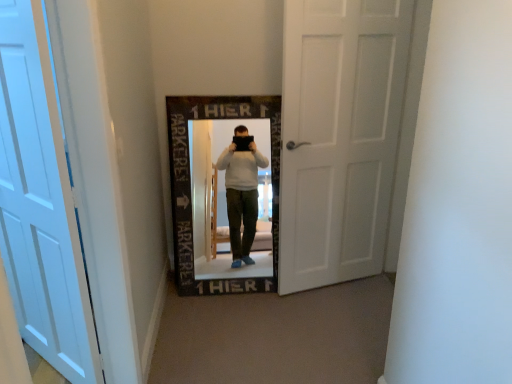
This screenshot has height=384, width=512. Describe the element at coordinates (339, 136) in the screenshot. I see `white matte door at center, which appears as the 1th door when viewed from the back` at that location.

Where is `white matte door at center, the 2th door when ordered from front to back`? white matte door at center, the 2th door when ordered from front to back is located at coordinates (339, 136).

This screenshot has width=512, height=384. Describe the element at coordinates (40, 203) in the screenshot. I see `white matte door at left, marked as the 1th door in a front-to-back arrangement` at that location.

The width and height of the screenshot is (512, 384). What are the coordinates of `white matte door at left, which is counted as the first door, starting from the left` in the screenshot? It's located at point(40,203).

Measure the distance between white matte door at left, which appears as the second door when viewed from the right, and camera.

They are 1.31 meters apart.

In order to click on white matte door at center, which appears as the 1th door when viewed from the back in this screenshot , I will do `click(339, 136)`.

Can you confirm if white matte door at center, positioned as the first door in right-to-left order, is positioned to the right of white matte door at left, which appears as the second door when viewed from the right?

Yes.

Does white matte door at center, positioned as the first door in right-to-left order, come in front of white matte door at left, which appears as the second door when viewed from the right?

No, white matte door at center, positioned as the first door in right-to-left order, is behind white matte door at left, which appears as the second door when viewed from the right.

Which is behind, point (350, 87) or point (46, 120)?

The point (350, 87) is farther.

From the image's perspective, is white matte door at center, the second door viewed from the left, beneath white matte door at left, marked as the 1th door in a front-to-back arrangement?

No.

From a real-world perspective, which is physically below, white matte door at center, positioned as the first door in right-to-left order, or white matte door at left, which appears as the second door when viewed from the right?

From a 3D spatial view, white matte door at left, which appears as the second door when viewed from the right, is below.

Can you confirm if white matte door at center, the 2th door when ordered from front to back, is thinner than white matte door at left, which appears as the second door when viewed from the right?

Indeed, white matte door at center, the 2th door when ordered from front to back, has a lesser width compared to white matte door at left, which appears as the second door when viewed from the right.

Which of these two, white matte door at center, the 2th door when ordered from front to back, or white matte door at left, placed as the 2th door when sorted from back to front, stands shorter?

white matte door at left, placed as the 2th door when sorted from back to front, is shorter.

Does white matte door at center, the second door viewed from the left, have a larger size compared to white matte door at left, which appears as the second door when viewed from the right?

Yes, white matte door at center, the second door viewed from the left, is bigger than white matte door at left, which appears as the second door when viewed from the right.

Is white matte door at center, which appears as the 1th door when viewed from the back, inside the boundaries of white matte door at left, marked as the 1th door in a front-to-back arrangement, or outside?

The correct answer is: outside.

Looking at this image, is white matte door at center, the 2th door when ordered from front to back, next to white matte door at left, which appears as the second door when viewed from the right?

No, white matte door at center, the 2th door when ordered from front to back, is not beside white matte door at left, which appears as the second door when viewed from the right.

Is white matte door at center, the 2th door when ordered from front to back, positioned with its back to white matte door at left, placed as the 2th door when sorted from back to front?

No, white matte door at center, the 2th door when ordered from front to back, is not facing away from white matte door at left, placed as the 2th door when sorted from back to front.

Can you tell me how much white matte door at center, positioned as the first door in right-to-left order, and white matte door at left, which is counted as the first door, starting from the left, differ in facing direction?

The angle between the facing direction of white matte door at center, positioned as the first door in right-to-left order, and the facing direction of white matte door at left, which is counted as the first door, starting from the left, is 63 degrees.

At what (x,y) coordinates should I click in order to perform the action: click on door below the white matte door at center, the second door viewed from the left (from a real-world perspective). Please return your answer as a coordinate pair (x, y). Looking at the image, I should click on (40, 203).

Is white matte door at left, which is counted as the first door, starting from the left, to the right of white matte door at center, the second door viewed from the left, from the viewer's perspective?

In fact, white matte door at left, which is counted as the first door, starting from the left, is to the left of white matte door at center, the second door viewed from the left.

Does white matte door at left, marked as the 1th door in a front-to-back arrangement, lie behind white matte door at center, positioned as the first door in right-to-left order?

No, white matte door at left, marked as the 1th door in a front-to-back arrangement, is in front of white matte door at center, positioned as the first door in right-to-left order.

Considering the positions of point (12, 59) and point (296, 221), is point (12, 59) closer or farther from the camera than point (296, 221)?

Point (12, 59).

From the image's perspective, who appears lower, white matte door at left, placed as the 2th door when sorted from back to front, or white matte door at center, the second door viewed from the left?

white matte door at left, placed as the 2th door when sorted from back to front, is shown below in the image.

Based on the photo, from a real-world perspective, relative to white matte door at center, the 2th door when ordered from front to back, is white matte door at left, placed as the 2th door when sorted from back to front, vertically above or below?

white matte door at left, placed as the 2th door when sorted from back to front, is below white matte door at center, the 2th door when ordered from front to back.

Considering the sizes of objects white matte door at left, which appears as the second door when viewed from the right, and white matte door at center, which appears as the 1th door when viewed from the back, in the image provided, who is thinner, white matte door at left, which appears as the second door when viewed from the right, or white matte door at center, which appears as the 1th door when viewed from the back,?

With smaller width is white matte door at center, which appears as the 1th door when viewed from the back.

Between white matte door at left, marked as the 1th door in a front-to-back arrangement, and white matte door at center, the 2th door when ordered from front to back, which one has less height?

→ With less height is white matte door at left, marked as the 1th door in a front-to-back arrangement.

Based on their sizes in the image, would you say white matte door at left, which is counted as the first door, starting from the left, is bigger or smaller than white matte door at center, the 2th door when ordered from front to back?

In the image, white matte door at left, which is counted as the first door, starting from the left, appears to be smaller than white matte door at center, the 2th door when ordered from front to back.

Is white matte door at center, the 2th door when ordered from front to back, a part of white matte door at left, which is counted as the first door, starting from the left?

Definitely not — white matte door at center, the 2th door when ordered from front to back, is not inside white matte door at left, which is counted as the first door, starting from the left.

Does white matte door at left, which is counted as the first door, starting from the left, touch white matte door at center, the second door viewed from the left?

No, white matte door at left, which is counted as the first door, starting from the left, is not beside white matte door at center, the second door viewed from the left.

Is white matte door at left, marked as the 1th door in a front-to-back arrangement, aimed at white matte door at center, positioned as the first door in right-to-left order?

No, white matte door at left, marked as the 1th door in a front-to-back arrangement, is not oriented towards white matte door at center, positioned as the first door in right-to-left order.

Consider the image. Can you tell me how much white matte door at left, which appears as the second door when viewed from the right, and white matte door at center, which appears as the 1th door when viewed from the back, differ in facing direction?

63 degrees separate the facing orientations of white matte door at left, which appears as the second door when viewed from the right, and white matte door at center, which appears as the 1th door when viewed from the back.

How much distance is there between white matte door at left, which appears as the second door when viewed from the right, and white matte door at center, the 2th door when ordered from front to back?

1.43 meters.

Locate an element on the screen. The width and height of the screenshot is (512, 384). door lying on the left of white matte door at center, the 2th door when ordered from front to back is located at coordinates (40, 203).

In the image, there is a white matte door at center, positioned as the first door in right-to-left order. Where is `door below it (from a real-world perspective)`? The width and height of the screenshot is (512, 384). door below it (from a real-world perspective) is located at coordinates (40, 203).

Identify the location of door below the white matte door at center, which appears as the 1th door when viewed from the back (from the image's perspective). (40, 203).